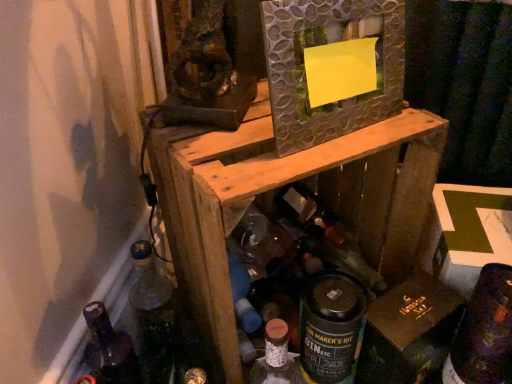
Question: From a real-world perspective, relative to wooden crate at center, is textured silver mirror at center vertically above or below?

Choices:
 (A) above
 (B) below

Answer: (A)

Question: In terms of width, does textured silver mirror at center look wider or thinner when compared to wooden crate at center?

Choices:
 (A) wide
 (B) thin

Answer: (B)

Question: Which object is positioned farthest from the green matte can at center, which appears as the 1th bottle when viewed from the right?

Choices:
 (A) translucent glass bottle at lower left, the 3th bottle viewed from the right
 (B) dark purple glass wine bottle at lower right, which ranks as the second wine bottle in back-to-front order
 (C) wooden crate at center
 (D) translucent glass bottle at center, which is the second bottle from right to left
 (E) brown cardboard at lower right

Answer: (A)

Question: Which is nearer to the textured silver mirror at center?

Choices:
 (A) translucent glass bottle at center, the second bottle from the left
 (B) brown cardboard at lower right
 (C) dark purple glass wine bottle at lower right, arranged as the 1th wine bottle when ordered from the bottom
 (D) translucent glass bottle at lower left, the 3th bottle viewed from the right
 (E) wooden crate at center

Answer: (E)